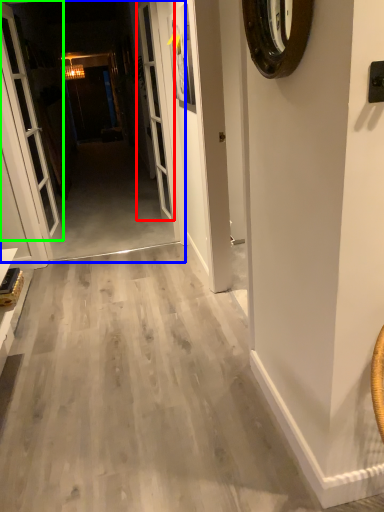
Question: Which object is positioned closest to screen door (highlighted by a red box)? Select from corridor (highlighted by a blue box) and door (highlighted by a green box).

Choices:
 (A) corridor
 (B) door

Answer: (B)